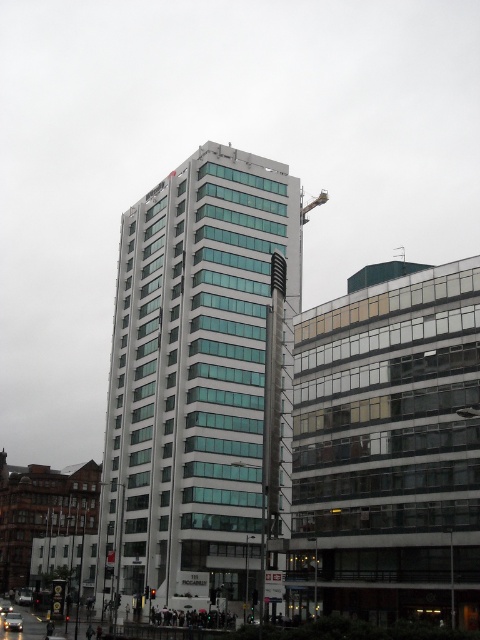
Question: Which object is the closest to the white glass building at center?

Choices:
 (A) metallic silver car at lower left
 (B) metallic silver car at center

Answer: (B)

Question: Does white glass building at center come behind metallic silver car at lower left?

Choices:
 (A) no
 (B) yes

Answer: (A)

Question: Which object is closer to the camera taking this photo?

Choices:
 (A) metallic silver car at lower left
 (B) metallic silver car at center
 (C) white glass building at center

Answer: (B)

Question: Does white glass building at center lie in front of metallic silver car at center?

Choices:
 (A) yes
 (B) no

Answer: (B)

Question: Among these points, which one is farthest from the camera?

Choices:
 (A) (1, 609)
 (B) (137, 515)

Answer: (A)

Question: Is metallic silver car at center smaller than metallic silver car at lower left?

Choices:
 (A) yes
 (B) no

Answer: (A)